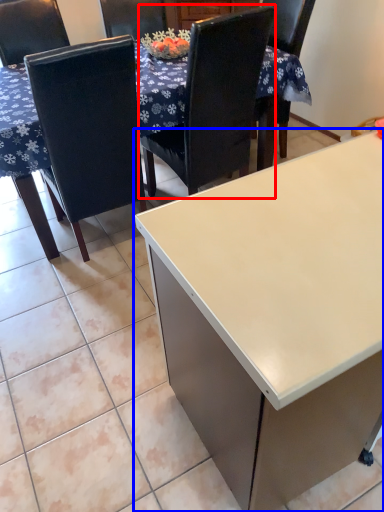
Question: Which object is further to the camera taking this photo, chair (highlighted by a red box) or desk (highlighted by a blue box)?

Choices:
 (A) chair
 (B) desk

Answer: (A)